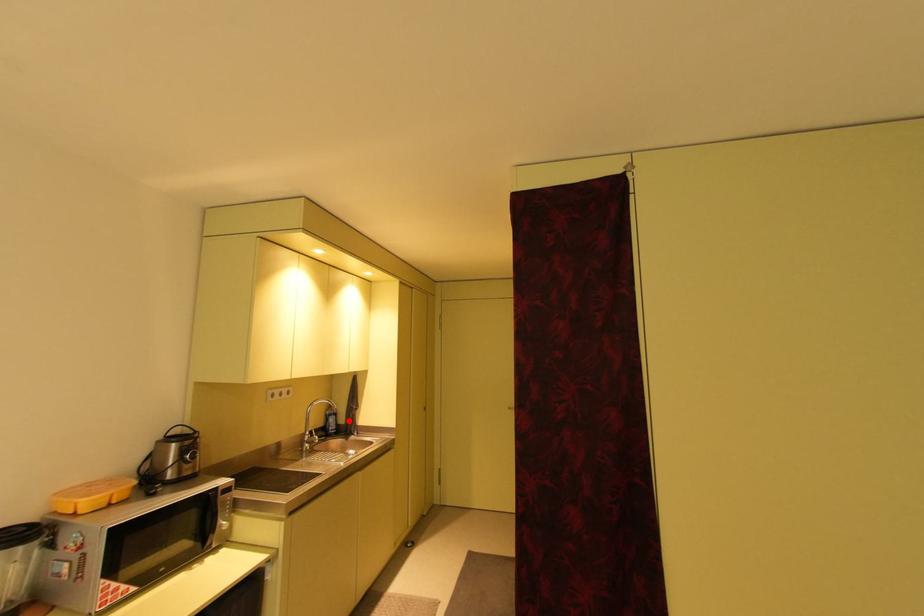
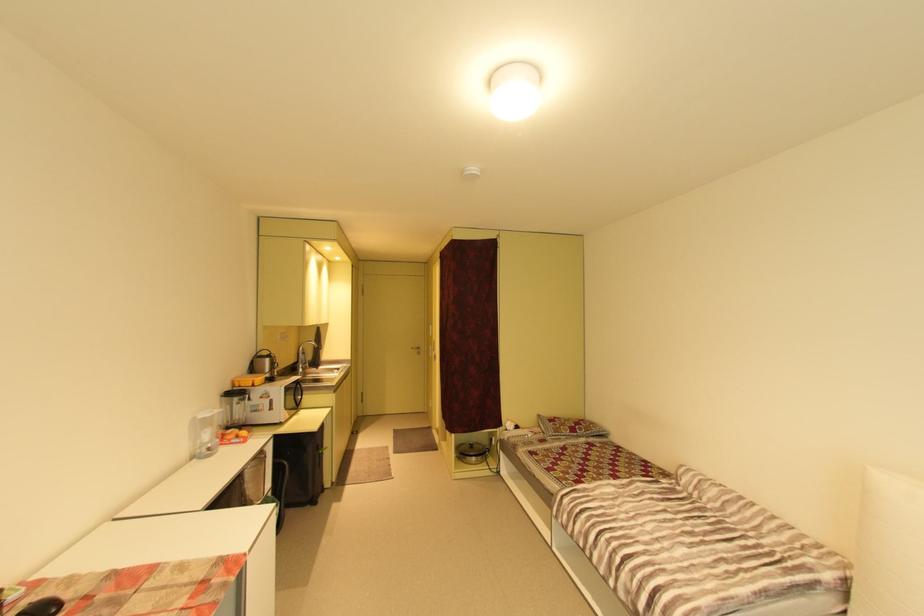
Locate, in the second image, the point that corresponds to the highlighted location in the first image.

(317, 358)